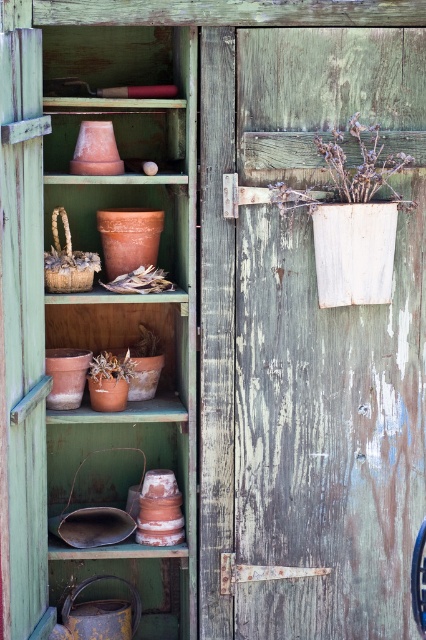
Is terracotta clay pots at left positioned at the back of dry wood branch at upper right?

That is False.

Which is more to the left, terracotta clay pots at left or dry wood branch at upper right?

terracotta clay pots at left is more to the left.

Find the location of `terracotta clay pots at left`. terracotta clay pots at left is located at coordinates (94, 317).

Is dry wood branch at upper right wider than matte brown pot at lower center?

Yes.

This screenshot has height=640, width=426. In order to click on dry wood branch at upper right in this screenshot , I will do `click(350, 170)`.

At what (x,y) coordinates should I click in order to perform the action: click on dry wood branch at upper right. Please return your answer as a coordinate pair (x, y). Looking at the image, I should click on (350, 170).

Who is more distant from viewer, (74,42) or (118,378)?

The point (74,42) is behind.

Looking at this image, which is above, terracotta clay pots at left or matte brown pot at lower center?

Positioned higher is terracotta clay pots at left.

Identify the location of terracotta clay pots at left. The height and width of the screenshot is (640, 426). (94, 317).